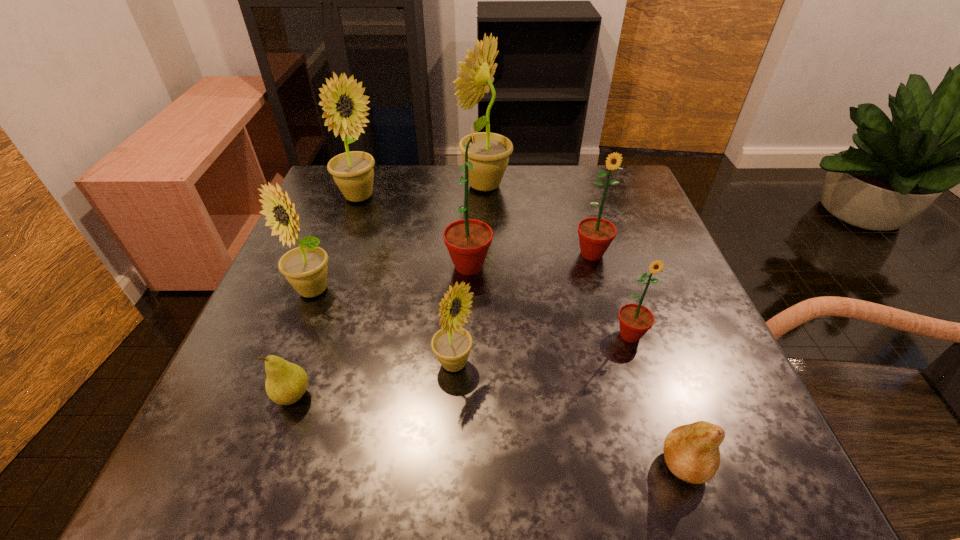
Identify the location of vacant region that satisfies the following two spatial constraints: 1. on the face of the biggest yellow sunflower; 2. on the face of the second nearest yellow sunflower. (486, 291).

Find the location of a particular element. The height and width of the screenshot is (540, 960). free spot that satisfies the following two spatial constraints: 1. on the face of the second biggest yellow sunflower; 2. on the face of the second nearest yellow sunflower is located at coordinates (325, 291).

Identify the location of vacant region that satisfies the following two spatial constraints: 1. on the face of the second biggest green sunflower; 2. on the face of the biggest green sunflower. Image resolution: width=960 pixels, height=540 pixels. (595, 266).